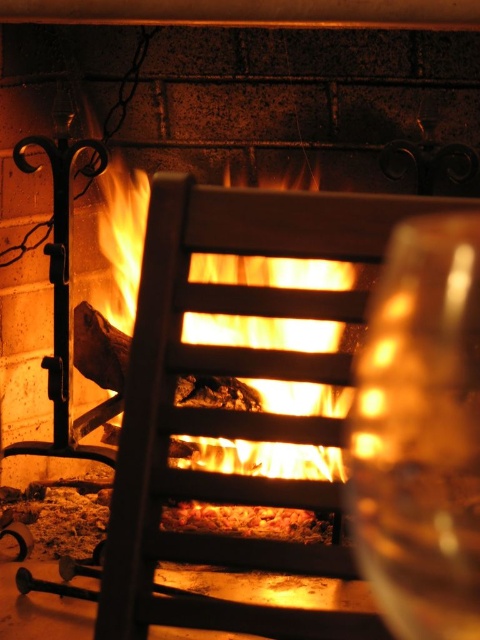
Does transparent glass at right have a greater height compared to orange glowing wood at center?

In fact, transparent glass at right may be shorter than orange glowing wood at center.

Is point (408, 260) less distant than point (240, 273)?

Yes, point (408, 260) is in front of point (240, 273).

At what (x,y) coordinates should I click in order to perform the action: click on transparent glass at right. Please return your answer as a coordinate pair (x, y). The width and height of the screenshot is (480, 640). Looking at the image, I should click on (420, 432).